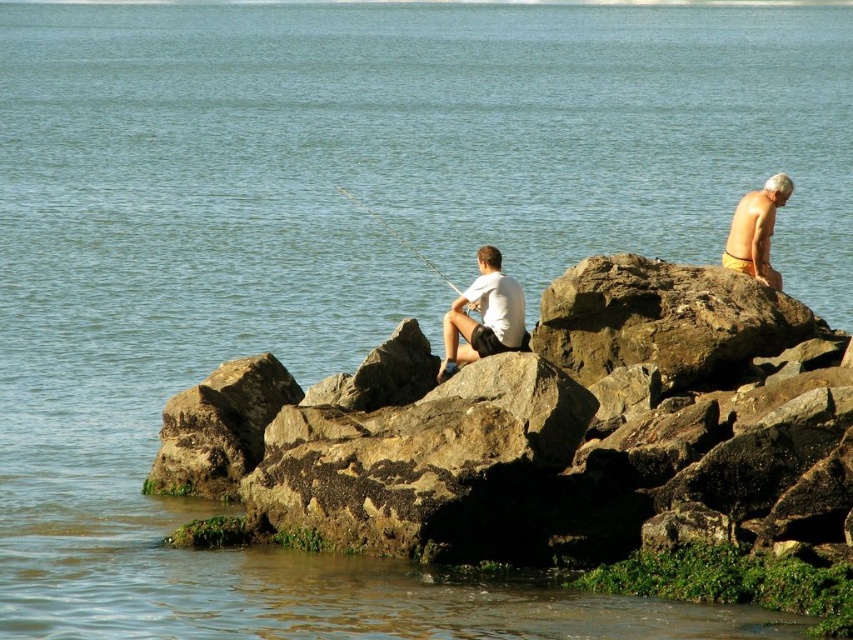
From the picture: Between white matte shirt at center and smooth white fishing pole at center, which one is positioned higher?

smooth white fishing pole at center

Is point (451, 346) more distant than point (358, 198)?

No, (451, 346) is closer to viewer.

Who is more forward, (500,323) or (387,227)?

Point (500,323) is in front.

This screenshot has height=640, width=853. In order to click on white matte shirt at center in this screenshot , I will do `click(485, 316)`.

Does point (461, 346) come behind point (733, 218)?

No, it is in front of (733, 218).

How far apart are white matte shirt at center and yellow matte shorts at upper right?

white matte shirt at center is 45.25 feet from yellow matte shorts at upper right.

Does point (508, 340) come in front of point (734, 209)?

Yes, it is.

Where is `white matte shirt at center`? The image size is (853, 640). white matte shirt at center is located at coordinates (485, 316).

Is point (769, 198) closer to viewer compared to point (361, 204)?

Yes, point (769, 198) is in front of point (361, 204).

In the scene shown: Does yellow matte shorts at upper right appear on the left side of smooth white fishing pole at center?

Incorrect, yellow matte shorts at upper right is not on the left side of smooth white fishing pole at center.

In order to click on yellow matte shorts at upper right in this screenshot , I will do `click(756, 230)`.